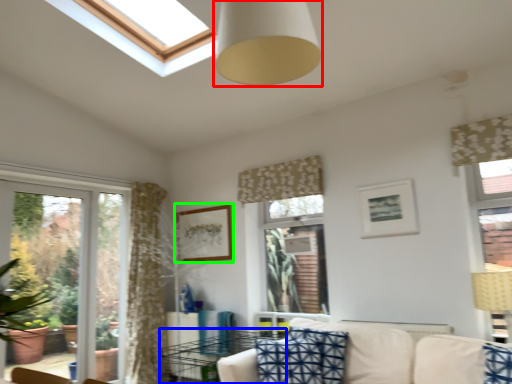
Question: Which object is the farthest from fixture (highlighted by a red box)? Choose among these: table (highlighted by a blue box) or picture frame (highlighted by a green box).

Choices:
 (A) table
 (B) picture frame

Answer: (A)